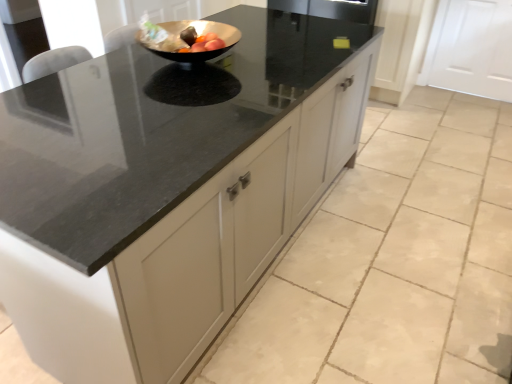
You are a GUI agent. You are given a task and a screenshot of the screen. Output one action in this format:
    pyautogui.click(x=<x>, y=<y>)
    Task: Click on the white matte door at upper right
    This screenshot has height=384, width=512.
    Given the screenshot: What is the action you would take?
    pyautogui.click(x=471, y=49)

What do you see at coordinates (471, 49) in the screenshot? The height and width of the screenshot is (384, 512). I see `white matte door at upper right` at bounding box center [471, 49].

Describe the element at coordinates (200, 41) in the screenshot. I see `metallic gold bowl at center` at that location.

Identify the location of metallic gold bowl at center. This screenshot has width=512, height=384. [x=200, y=41].

Where is `white matte door at upper right`? white matte door at upper right is located at coordinates (471, 49).

Is metallic gold bowl at center at the right side of white matte door at upper right?

Incorrect, metallic gold bowl at center is not on the right side of white matte door at upper right.

Is metallic gold bowl at center in front of white matte door at upper right?

Yes, metallic gold bowl at center is in front of white matte door at upper right.

Between point (190, 46) and point (431, 49), which one is positioned in front?

Point (190, 46)

From the image's perspective, which one is positioned higher, metallic gold bowl at center or white matte door at upper right?

white matte door at upper right.

From a real-world perspective, which is physically above, metallic gold bowl at center or white matte door at upper right?

metallic gold bowl at center is physically above.

Considering the relative sizes of metallic gold bowl at center and white matte door at upper right in the image provided, is metallic gold bowl at center wider than white matte door at upper right?

Indeed, metallic gold bowl at center has a greater width compared to white matte door at upper right.

Considering the relative sizes of metallic gold bowl at center and white matte door at upper right in the image provided, is metallic gold bowl at center shorter than white matte door at upper right?

Yes.

Who is smaller, metallic gold bowl at center or white matte door at upper right?

metallic gold bowl at center is smaller.

Choose the correct answer: Is metallic gold bowl at center inside white matte door at upper right or outside it?

metallic gold bowl at center cannot be found inside white matte door at upper right.

Is metallic gold bowl at center not close to white matte door at upper right?

metallic gold bowl at center is far away from white matte door at upper right.

Does metallic gold bowl at center turn towards white matte door at upper right?

No.

Can you tell me how much metallic gold bowl at center and white matte door at upper right differ in facing direction?

The facing directions of metallic gold bowl at center and white matte door at upper right are 85.3 degrees apart.

Find the location of `fruit below the white matte door at upper right (from the image's perspective)`. fruit below the white matte door at upper right (from the image's perspective) is located at coordinates (200, 41).

Based on their positions, is white matte door at upper right located to the left or right of metallic gold bowl at center?

In the image, white matte door at upper right appears on the right side of metallic gold bowl at center.

Is white matte door at upper right positioned before metallic gold bowl at center?

No, white matte door at upper right is further to the viewer.

Is point (472, 89) positioned behind point (195, 38)?

Yes, it is.

From the image's perspective, relative to metallic gold bowl at center, is white matte door at upper right above or below?

Clearly, from the image's perspective, white matte door at upper right is above metallic gold bowl at center.

From a real-world perspective, which is physically above, white matte door at upper right or metallic gold bowl at center?

metallic gold bowl at center is physically above.

In the scene shown: Considering the relative sizes of white matte door at upper right and metallic gold bowl at center in the image provided, is white matte door at upper right wider than metallic gold bowl at center?

No.

Is white matte door at upper right taller or shorter than metallic gold bowl at center?

Clearly, white matte door at upper right is taller compared to metallic gold bowl at center.

Looking at the image, does white matte door at upper right seem bigger or smaller compared to metallic gold bowl at center?

white matte door at upper right is bigger than metallic gold bowl at center.

Is white matte door at upper right inside or outside of metallic gold bowl at center?

white matte door at upper right exists outside the volume of metallic gold bowl at center.

Looking at this image, would you say white matte door at upper right is a long distance from metallic gold bowl at center?

Yes, white matte door at upper right and metallic gold bowl at center are quite far apart.

Looking at this image, is white matte door at upper right aimed at metallic gold bowl at center?

Yes, white matte door at upper right faces towards metallic gold bowl at center.

Where is `fruit above the white matte door at upper right (from a real-world perspective)`? The width and height of the screenshot is (512, 384). fruit above the white matte door at upper right (from a real-world perspective) is located at coordinates (200, 41).

At what (x,y) coordinates should I click in order to perform the action: click on fruit that is on the left side of white matte door at upper right. Please return your answer as a coordinate pair (x, y). The height and width of the screenshot is (384, 512). Looking at the image, I should click on (200, 41).

Where is `cabinetry on the right side of metallic gold bowl at center`? cabinetry on the right side of metallic gold bowl at center is located at coordinates (471, 49).